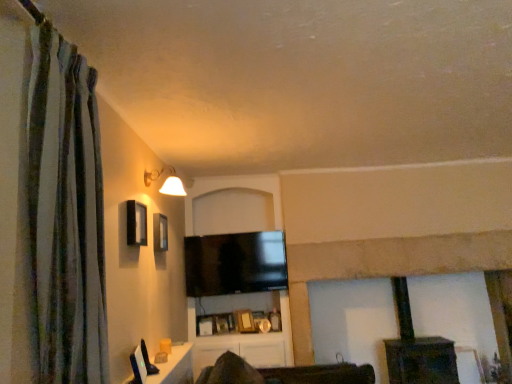
Question: Does white glossy table at lower left come in front of flat screen tv at center?

Choices:
 (A) yes
 (B) no

Answer: (A)

Question: Is white glossy table at lower left oriented towards flat screen tv at center?

Choices:
 (A) yes
 (B) no

Answer: (B)

Question: Is white glossy table at lower left at the left side of flat screen tv at center?

Choices:
 (A) yes
 (B) no

Answer: (A)

Question: Is white glossy table at lower left taller than flat screen tv at center?

Choices:
 (A) yes
 (B) no

Answer: (B)

Question: Is white glossy table at lower left shorter than flat screen tv at center?

Choices:
 (A) yes
 (B) no

Answer: (A)

Question: From the image's perspective, is matte white lampshade at upper left positioned above or below dark brown wood fireplace at center?

Choices:
 (A) below
 (B) above

Answer: (B)

Question: Is matte white lampshade at upper left bigger or smaller than dark brown wood fireplace at center?

Choices:
 (A) small
 (B) big

Answer: (A)

Question: Looking at their shapes, would you say matte white lampshade at upper left is wider or thinner than dark brown wood fireplace at center?

Choices:
 (A) thin
 (B) wide

Answer: (A)

Question: Is matte white lampshade at upper left situated inside dark brown wood fireplace at center or outside?

Choices:
 (A) outside
 (B) inside

Answer: (A)

Question: Is white glossy table at lower left bigger or smaller than dark brown wood fireplace at center?

Choices:
 (A) small
 (B) big

Answer: (A)

Question: Does point click(x=152, y=375) appear closer or farther from the camera than point click(x=403, y=370)?

Choices:
 (A) farther
 (B) closer

Answer: (B)

Question: Is white glossy table at lower left in front of or behind dark brown wood fireplace at center in the image?

Choices:
 (A) front
 (B) behind

Answer: (A)

Question: From a real-world perspective, is white glossy table at lower left positioned above or below dark brown wood fireplace at center?

Choices:
 (A) below
 (B) above

Answer: (B)

Question: Looking at the image, does white glossy table at lower left seem bigger or smaller compared to matte black window at upper left?

Choices:
 (A) small
 (B) big

Answer: (B)

Question: Does point (189, 380) appear closer or farther from the camera than point (134, 236)?

Choices:
 (A) closer
 (B) farther

Answer: (B)